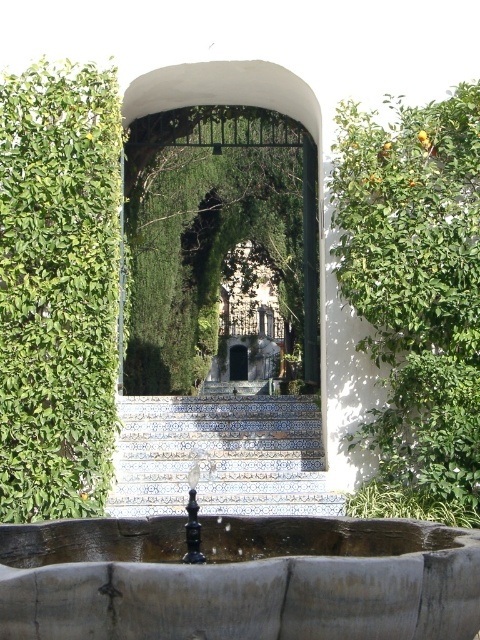
This screenshot has width=480, height=640. What do you see at coordinates (58, 289) in the screenshot?
I see `green leafy hedge at left` at bounding box center [58, 289].

Locate an element on the screen. This screenshot has width=480, height=640. green leafy hedge at left is located at coordinates (58, 289).

Based on the photo, between green leafy hedge at left and blue tile stairs at center, which one appears on the left side from the viewer's perspective?

From the viewer's perspective, green leafy hedge at left appears more on the left side.

Based on the photo, between green leafy hedge at left and blue tile stairs at center, which one appears on the right side from the viewer's perspective?

Positioned to the right is blue tile stairs at center.

The image size is (480, 640). Identify the location of green leafy hedge at left. (58, 289).

Identify the location of green leafy hedge at left. (58, 289).

Can you confirm if green leafy hedge at right is bigger than green leafy archway at center?

Actually, green leafy hedge at right might be smaller than green leafy archway at center.

Is green leafy hedge at right closer to the viewer compared to green leafy archway at center?

That is True.

Who is more forward, (414,369) or (259,154)?

Point (414,369) is in front.

Locate an element on the screen. green leafy hedge at right is located at coordinates (416, 285).